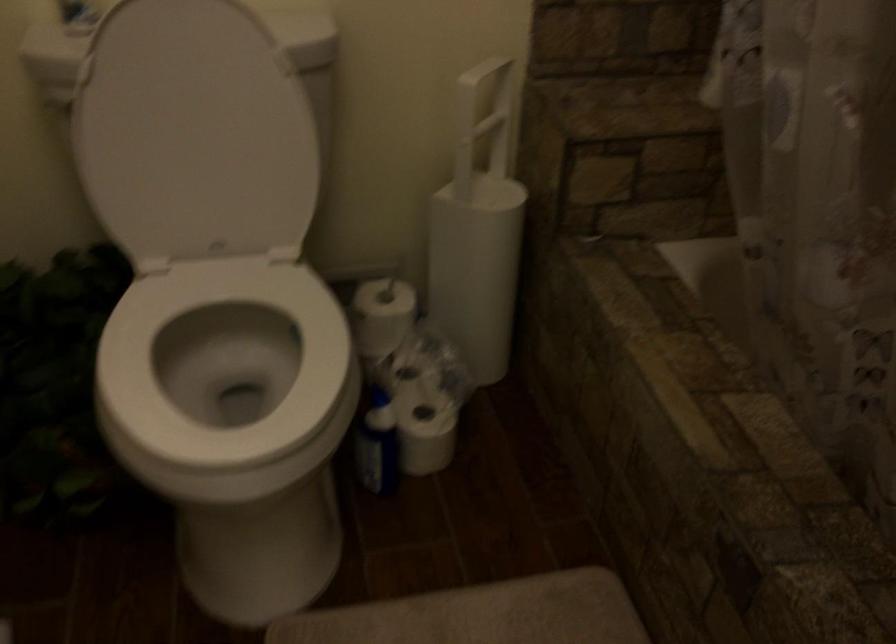
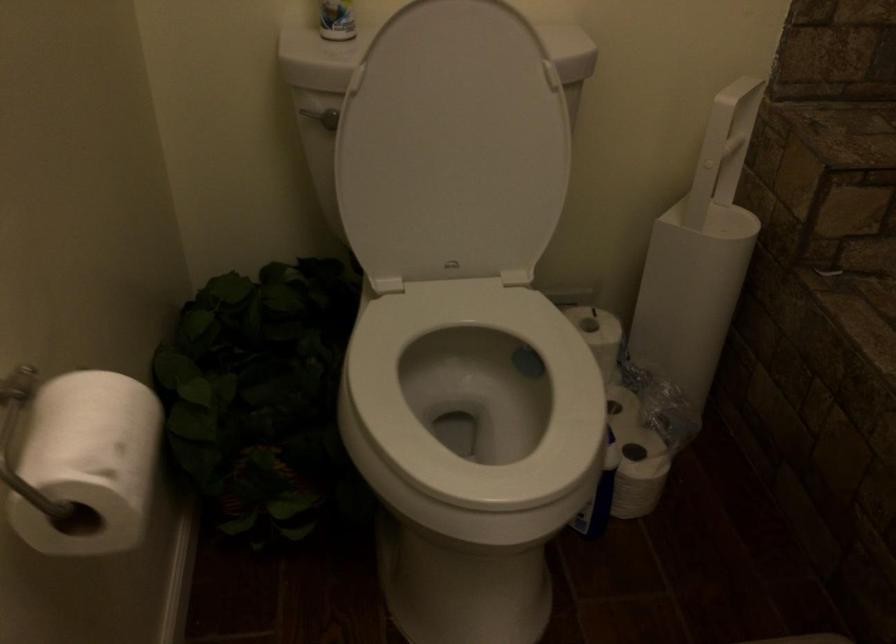
Question: What movement of the cameraman would produce the second image?

Choices:
 (A) Left
 (B) Right
 (C) Forward
 (D) Backward

Answer: (A)